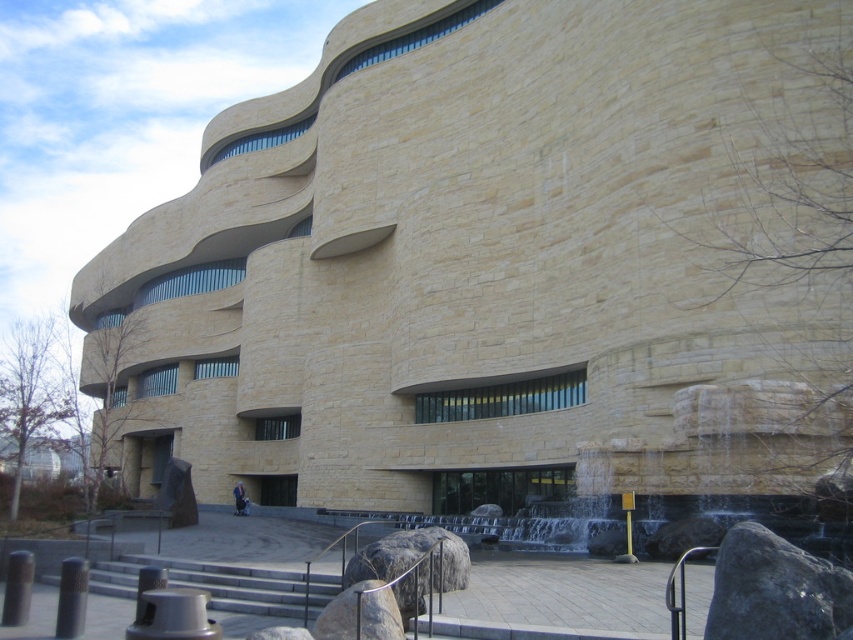
Question: Can you confirm if dark gray rock at lower right is wider than smooth gray rock at lower center?

Choices:
 (A) yes
 (B) no

Answer: (A)

Question: Is dark gray rock at lower right wider than smooth gray rock at lower center?

Choices:
 (A) yes
 (B) no

Answer: (A)

Question: Does dark gray rock at lower right have a larger size compared to smooth gray rock at lower center?

Choices:
 (A) no
 (B) yes

Answer: (B)

Question: Which of these objects is positioned farthest from the metallic gray stairs at lower center?

Choices:
 (A) smooth gray rock at lower center
 (B) dark gray rock at lower right

Answer: (B)

Question: Which point appears farthest from the camera in this image?

Choices:
 (A) (299, 579)
 (B) (724, 611)

Answer: (A)

Question: Which is nearer to the metallic gray stairs at lower center?

Choices:
 (A) dark gray rock at lower right
 (B) smooth gray rock at lower center

Answer: (B)